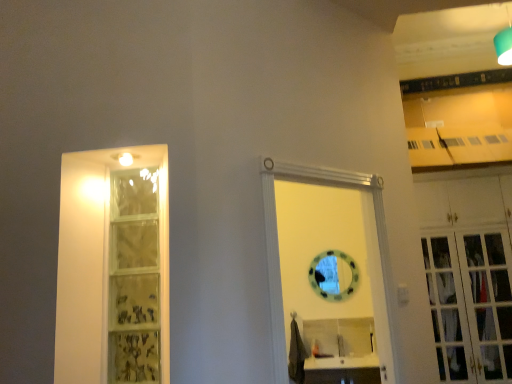
Question: In terms of height, does matte glass shelf at left look taller or shorter compared to white wood cabinet at right?

Choices:
 (A) short
 (B) tall

Answer: (A)

Question: Is matte glass shelf at left in front of or behind white wood cabinet at right in the image?

Choices:
 (A) behind
 (B) front

Answer: (B)

Question: Based on their relative distances, which object is farther from the white wood cabinet at right?

Choices:
 (A) matte glass shelf at left
 (B) white wooden door at center

Answer: (A)

Question: Estimate the real-world distances between objects in this image. Which object is farther from the matte glass shelf at left?

Choices:
 (A) white wood cabinet at right
 (B) white wooden door at center

Answer: (A)